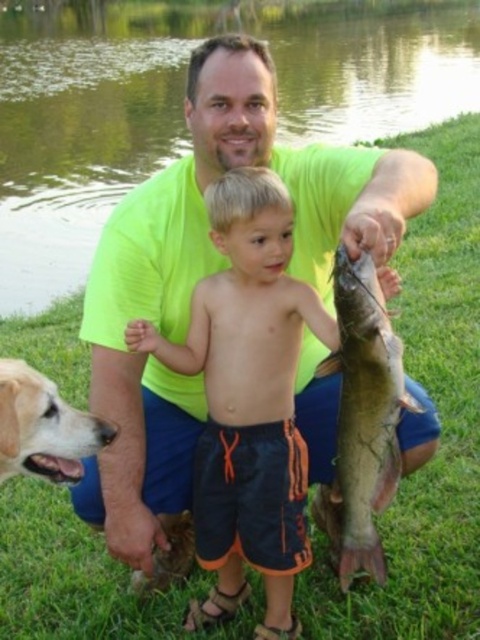
Is green grass at lower center below shiny silver fish at center?

No, green grass at lower center is not below shiny silver fish at center.

Is green grass at lower center thinner than shiny silver fish at center?

No, green grass at lower center is not thinner than shiny silver fish at center.

Which is behind, point (54, 262) or point (393, 404)?

Positioned behind is point (54, 262).

Identify the location of green grass at lower center. 181,104.

Does green grass at lower center appear over orange swim trunks at center?

Indeed, green grass at lower center is positioned over orange swim trunks at center.

Which of these two, green grass at lower center or orange swim trunks at center, stands taller?

With more height is green grass at lower center.

Describe the element at coordinates (181, 104) in the screenshot. This screenshot has width=480, height=640. I see `green grass at lower center` at that location.

The height and width of the screenshot is (640, 480). What are the coordinates of `green grass at lower center` in the screenshot? It's located at (x=181, y=104).

Is neon yellow t-shirt at center shorter than golden fur dog at lower left?

No.

Does neon yellow t-shirt at center have a lesser width compared to golden fur dog at lower left?

No, neon yellow t-shirt at center is not thinner than golden fur dog at lower left.

Does point (402, 456) come farther from viewer compared to point (60, 401)?

Yes, it is.

At what (x,y) coordinates should I click in order to perform the action: click on neon yellow t-shirt at center. Please return your answer as a coordinate pair (x, y). The height and width of the screenshot is (640, 480). Looking at the image, I should click on (204, 275).